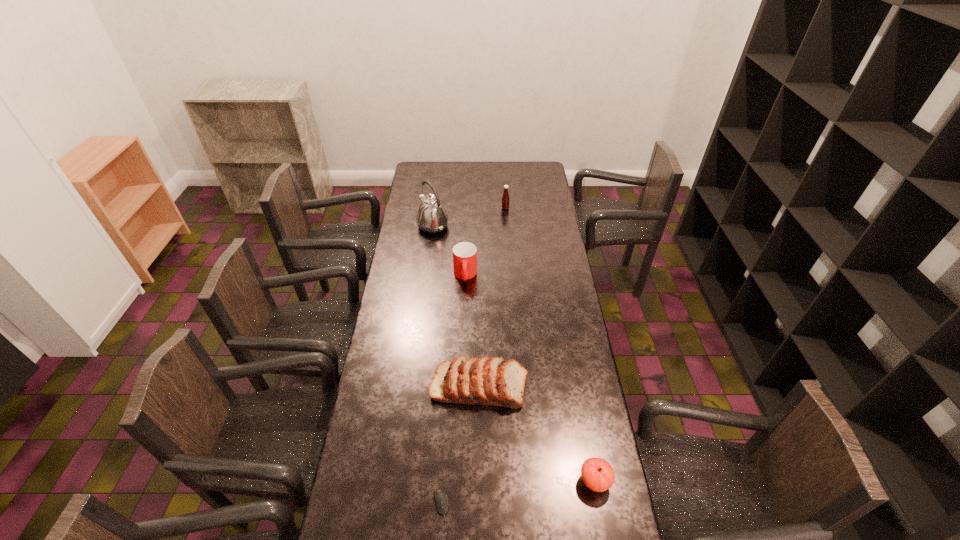
Image resolution: width=960 pixels, height=540 pixels. In order to click on free space that satisfies the following two spatial constraints: 1. on the side of the apple with the handle; 2. on the right side of the fourth nearest object in this screenshot , I will do `click(458, 482)`.